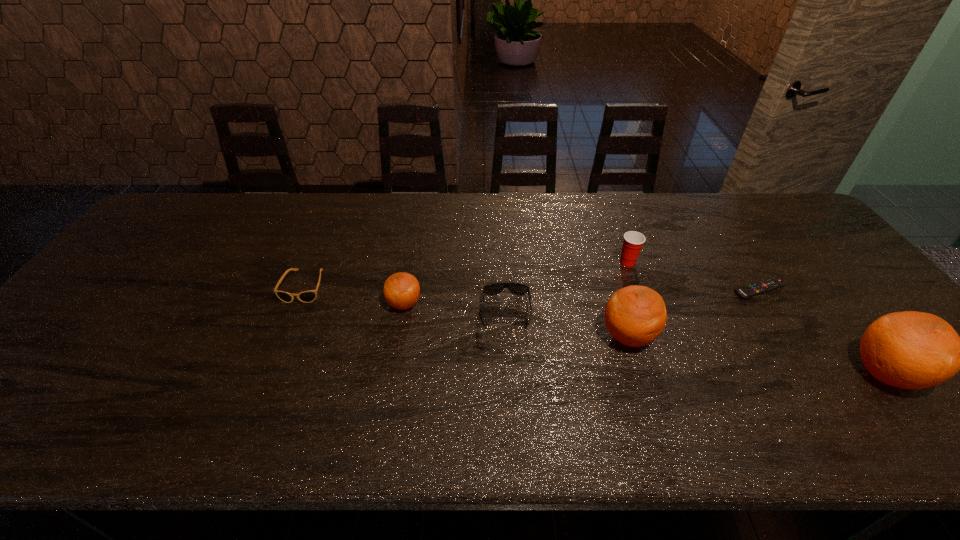
Where is `free space between the right sunglasses and the second orange from right to left`? Image resolution: width=960 pixels, height=540 pixels. free space between the right sunglasses and the second orange from right to left is located at coordinates (567, 324).

Identify the location of free space between the leftmost object and the sixth object from right to left. This screenshot has width=960, height=540. (354, 295).

Identify the location of object that can be found as the closest to the left sunglasses. (401, 290).

Select which object appears as the fifth closest to the sixth object from left to right. Please provide its 2D coordinates. Your answer should be formatted as a tuple, i.e. [(x, y)], where the tuple contains the x and y coordinates of a point satisfying the conditions above.

[(401, 290)]

Find the location of a particular element. The image size is (960, 540). the second closest orange relative to the shortest orange is located at coordinates [x=911, y=350].

Identify which orange is the closest to the Dixie cup. Please provide its 2D coordinates. Your answer should be formatted as a tuple, i.e. [(x, y)], where the tuple contains the x and y coordinates of a point satisfying the conditions above.

[(635, 315)]

Where is `free space that satisfies the following two spatial constraints: 1. on the front-facing side of the leftmost object; 2. on the right side of the second tallest orange`? free space that satisfies the following two spatial constraints: 1. on the front-facing side of the leftmost object; 2. on the right side of the second tallest orange is located at coordinates (284, 336).

At what (x,y) coordinates should I click in order to perform the action: click on vacant region that satisfies the following two spatial constraints: 1. on the front side of the rightmost object; 2. on the right side of the second tallest orange. Please return your answer as a coordinate pair (x, y). The height and width of the screenshot is (540, 960). Looking at the image, I should click on (639, 373).

Find the location of a particular element. The height and width of the screenshot is (540, 960). vacant region that satisfies the following two spatial constraints: 1. on the back side of the second tallest orange; 2. on the left side of the Dixie cup is located at coordinates (605, 262).

This screenshot has width=960, height=540. In order to click on free space in the image that satisfies the following two spatial constraints: 1. on the front-facing side of the second tallest orange; 2. on the left side of the left sunglasses in this screenshot , I will do `click(284, 336)`.